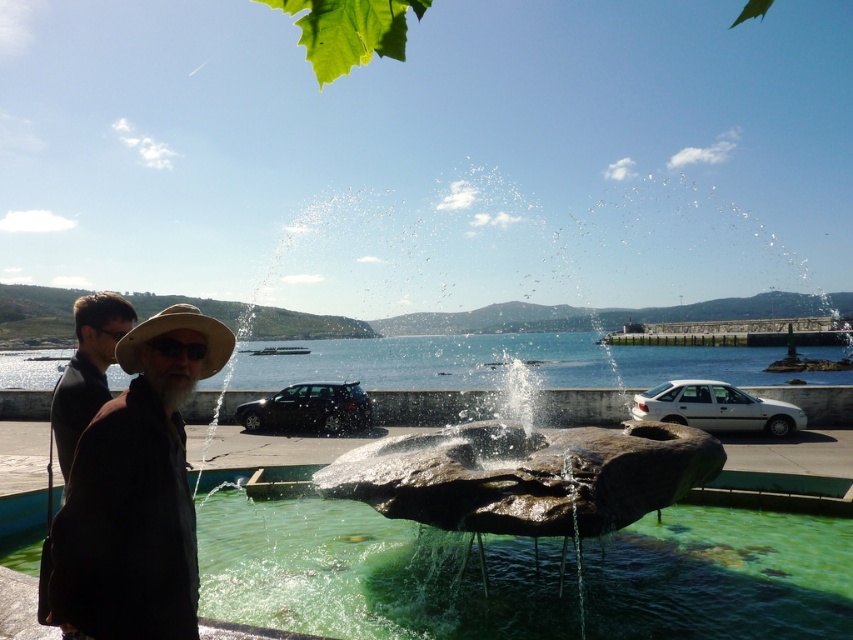
Question: Observing the image, what is the correct spatial positioning of dark brown leather jacket at left in reference to natural straw cowboy hat at center?

Choices:
 (A) left
 (B) right

Answer: (A)

Question: Which point appears farthest from the camera in this image?

Choices:
 (A) (202, 372)
 (B) (105, 321)

Answer: (B)

Question: Can you confirm if green stone water at center is wider than natural straw cowboy hat at center?

Choices:
 (A) no
 (B) yes

Answer: (A)

Question: Can you confirm if dark brown leather jacket at left is thinner than natural straw cowboy hat at center?

Choices:
 (A) no
 (B) yes

Answer: (A)

Question: Which point is closer to the camera?

Choices:
 (A) (86, 339)
 (B) (142, 513)
 (C) (660, 604)
 (D) (146, 326)

Answer: (B)

Question: Which of the following is the farthest from the observer?

Choices:
 (A) (547, 548)
 (B) (135, 428)

Answer: (A)